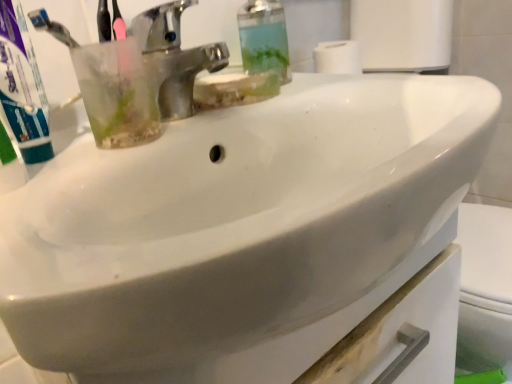
Image resolution: width=512 pixels, height=384 pixels. Describe the element at coordinates (21, 89) in the screenshot. I see `green matte toothpaste at left` at that location.

This screenshot has height=384, width=512. Describe the element at coordinates (264, 38) in the screenshot. I see `transparent plastic soap dispenser at upper center` at that location.

The image size is (512, 384). Identify the location of green matte toothpaste at left. (21, 89).

Can you confirm if transparent plastic soap dispenser at upper center is smaller than polished chrome faucet at upper center?

Indeed, transparent plastic soap dispenser at upper center has a smaller size compared to polished chrome faucet at upper center.

From a real-world perspective, is transparent plastic soap dispenser at upper center below polished chrome faucet at upper center?

Actually, transparent plastic soap dispenser at upper center is physically above polished chrome faucet at upper center in the real world.

What's the angular difference between transparent plastic soap dispenser at upper center and polished chrome faucet at upper center's facing directions?

1.74 degrees separate the facing orientations of transparent plastic soap dispenser at upper center and polished chrome faucet at upper center.

At what (x,y) coordinates should I click in order to perform the action: click on tap directly beneath the transparent plastic soap dispenser at upper center (from a real-world perspective). Please return your answer as a coordinate pair (x, y). This screenshot has width=512, height=384. Looking at the image, I should click on (173, 58).

From a real-world perspective, which object rests below the other?

From a 3D spatial view, green matte toothpaste at left is below.

Is transparent plastic soap dispenser at upper center taller than green matte toothpaste at left?

Correct, transparent plastic soap dispenser at upper center is much taller as green matte toothpaste at left.

What's the angular difference between transparent plastic soap dispenser at upper center and green matte toothpaste at left's facing directions?

The angle between the facing direction of transparent plastic soap dispenser at upper center and the facing direction of green matte toothpaste at left is 0.00803 degrees.

Measure the distance between transparent plastic soap dispenser at upper center and green matte toothpaste at left.

transparent plastic soap dispenser at upper center and green matte toothpaste at left are 31.67 centimeters apart.

From the picture: From a real-world perspective, relative to polished chrome faucet at upper center, is green matte toothpaste at left vertically above or below?

green matte toothpaste at left is situated higher than polished chrome faucet at upper center in the real world.

Between green matte toothpaste at left and polished chrome faucet at upper center, which one has more height?

Standing taller between the two is green matte toothpaste at left.

Is green matte toothpaste at left positioned with its back to polished chrome faucet at upper center?

green matte toothpaste at left does not have its back to polished chrome faucet at upper center.

In the image, is green matte toothpaste at left on the left side or the right side of polished chrome faucet at upper center?

Clearly, green matte toothpaste at left is on the left of polished chrome faucet at upper center in the image.

From the picture: From a real-world perspective, which is physically above, polished chrome faucet at upper center or transparent plastic soap dispenser at upper center?

In real-world perspective, transparent plastic soap dispenser at upper center is above.

Is polished chrome faucet at upper center situated inside transparent plastic soap dispenser at upper center or outside?

polished chrome faucet at upper center exists outside the volume of transparent plastic soap dispenser at upper center.

Who is more distant, polished chrome faucet at upper center or transparent plastic soap dispenser at upper center?

transparent plastic soap dispenser at upper center is more distant.

Which is nearer, (189, 115) or (1, 37)?

Clearly, point (189, 115) is more distant from the camera than point (1, 37).

In the scene shown: Would you say polished chrome faucet at upper center contains green matte toothpaste at left?

No.

At what (x,y) coordinates should I click in order to perform the action: click on toothpaste that is in front of the polished chrome faucet at upper center. Please return your answer as a coordinate pair (x, y). Looking at the image, I should click on (21, 89).

Which of these two, green matte toothpaste at left or transparent plastic soap dispenser at upper center, is thinner?

green matte toothpaste at left is thinner.

What's the angular difference between green matte toothpaste at left and transparent plastic soap dispenser at upper center's facing directions?

0.00803 degrees.

Which is correct: green matte toothpaste at left is inside transparent plastic soap dispenser at upper center, or outside of it?

green matte toothpaste at left is not inside transparent plastic soap dispenser at upper center, it's outside.

You are a GUI agent. You are given a task and a screenshot of the screen. Output one action in this format:
    pyautogui.click(x=<x>, y=<y>)
    Task: Click on the soap dispenser lying above the green matte toothpaste at left (from the image's perspective)
    The image size is (512, 384).
    Given the screenshot: What is the action you would take?
    pyautogui.click(x=264, y=38)

Locate an element on the screen. soap dispenser that appears above the polished chrome faucet at upper center (from a real-world perspective) is located at coordinates (264, 38).

Identify the location of toothpaste lying on the left of transparent plastic soap dispenser at upper center. The width and height of the screenshot is (512, 384). (21, 89).

Considering their positions, is green matte toothpaste at left positioned further to transparent plastic soap dispenser at upper center than polished chrome faucet at upper center?

The object further to transparent plastic soap dispenser at upper center is green matte toothpaste at left.

Looking at the image, which one is located further to transparent plastic soap dispenser at upper center, polished chrome faucet at upper center or green matte toothpaste at left?

green matte toothpaste at left.

From the picture: Estimate the real-world distances between objects in this image. Which object is further from polished chrome faucet at upper center, green matte toothpaste at left or transparent plastic soap dispenser at upper center?

green matte toothpaste at left.

When comparing their distances from polished chrome faucet at upper center, does transparent plastic soap dispenser at upper center or green matte toothpaste at left seem further?

green matte toothpaste at left.

Which object lies nearer to the anchor point green matte toothpaste at left, polished chrome faucet at upper center or transparent plastic soap dispenser at upper center?

polished chrome faucet at upper center is positioned closer to the anchor green matte toothpaste at left.

Which object lies nearer to the anchor point green matte toothpaste at left, transparent plastic soap dispenser at upper center or polished chrome faucet at upper center?

polished chrome faucet at upper center is closer to green matte toothpaste at left.

I want to click on tap between green matte toothpaste at left and transparent plastic soap dispenser at upper center in the horizontal direction, so click(173, 58).